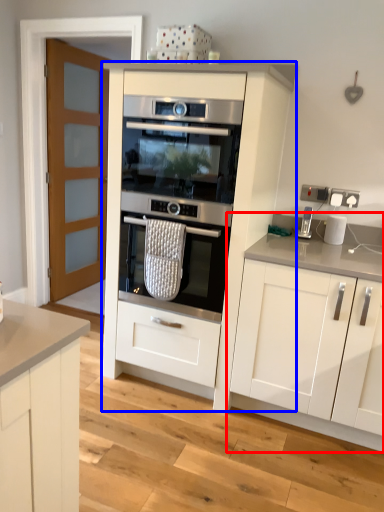
Question: Which point is further to the camera, cabinetry (highlighted by a red box) or cabinetry (highlighted by a blue box)?

Choices:
 (A) cabinetry
 (B) cabinetry

Answer: (B)